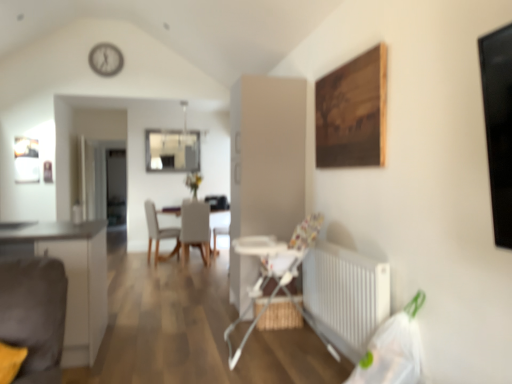
This screenshot has width=512, height=384. Identify the location of free spot below matte gray chair at center, which ranks as the first chair in right-to-left order (from a real-world perspective). (195, 259).